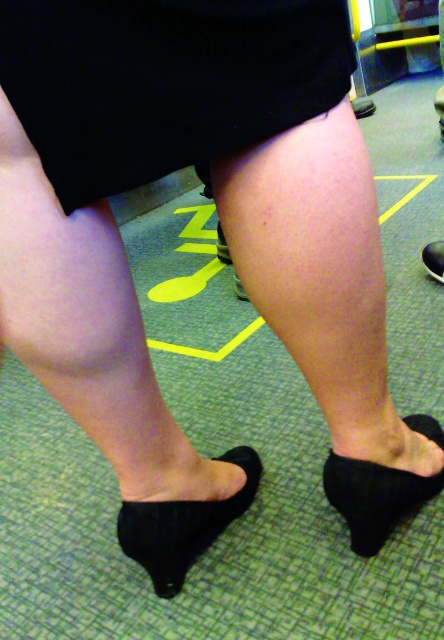
Question: Among these points, which one is nearest to the camera?

Choices:
 (A) (372, 502)
 (B) (305, 339)

Answer: (B)

Question: Is suede skirt at center in front of black suede high-heeled shoe at lower center?

Choices:
 (A) yes
 (B) no

Answer: (A)

Question: Considering the relative positions of suede skirt at center and smooth skin leg at center in the image provided, where is suede skirt at center located with respect to smooth skin leg at center?

Choices:
 (A) left
 (B) right

Answer: (A)

Question: Which object appears farthest from the camera in this image?

Choices:
 (A) smooth skin leg at center
 (B) black suede shoe at lower right
 (C) black suede high-heeled shoe at lower center

Answer: (B)

Question: Can you confirm if suede skirt at center is wider than black suede mule at lower center?

Choices:
 (A) yes
 (B) no

Answer: (A)

Question: Among these objects, which one is farthest from the camera?

Choices:
 (A) black suede mule at lower center
 (B) black suede shoe at lower right

Answer: (B)